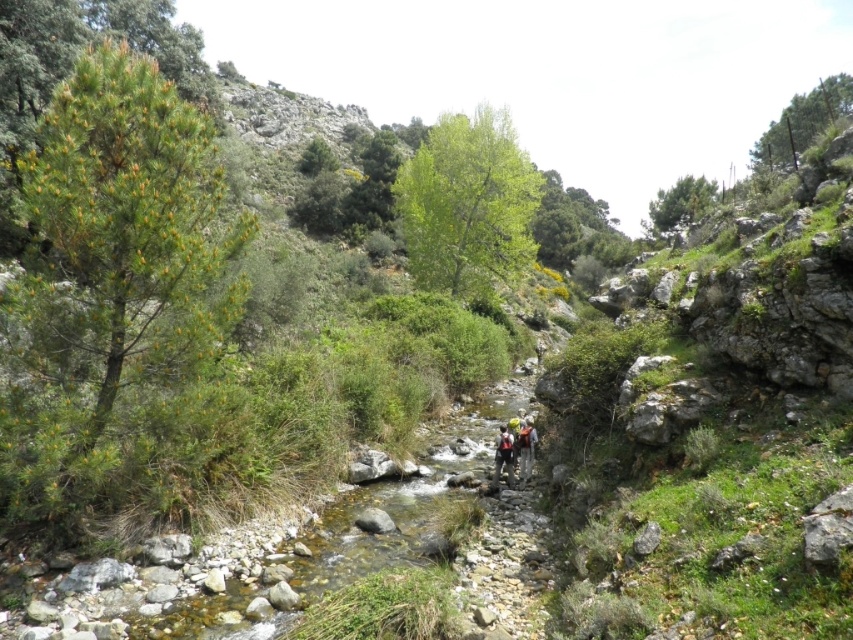
Based on the photo, does smooth rock stream at center have a larger size compared to yellow helmeted person at center?

Yes.

Which is in front, point (288, 557) or point (521, 464)?

Point (288, 557)

Is point (505, 598) behind point (521, 426)?

No, (505, 598) is in front of (521, 426).

Identify the location of smooth rock stream at center. (399, 504).

Who is positioned more to the right, yellow helmeted person at center or yellow-green fabric backpack at center?

From the viewer's perspective, yellow helmeted person at center appears more on the right side.

Between yellow helmeted person at center and yellow-green fabric backpack at center, which one has more height?

yellow helmeted person at center is taller.

At what (x,y) coordinates should I click in order to perform the action: click on yellow helmeted person at center. Please return your answer as a coordinate pair (x, y). Image resolution: width=853 pixels, height=640 pixels. Looking at the image, I should click on (526, 449).

Is smooth rock stream at center shorter than yellow-green fabric backpack at center?

Indeed, smooth rock stream at center has a lesser height compared to yellow-green fabric backpack at center.

Looking at this image, is smooth rock stream at center behind yellow-green fabric backpack at center?

No.

Does point (303, 566) come behind point (509, 461)?

No.

What are the coordinates of `smooth rock stream at center` in the screenshot? It's located at (399, 504).